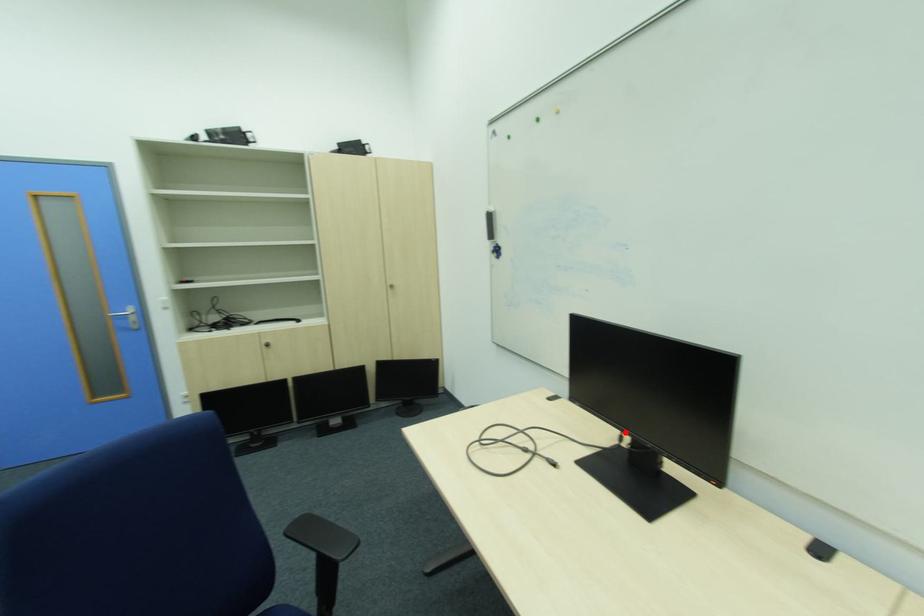
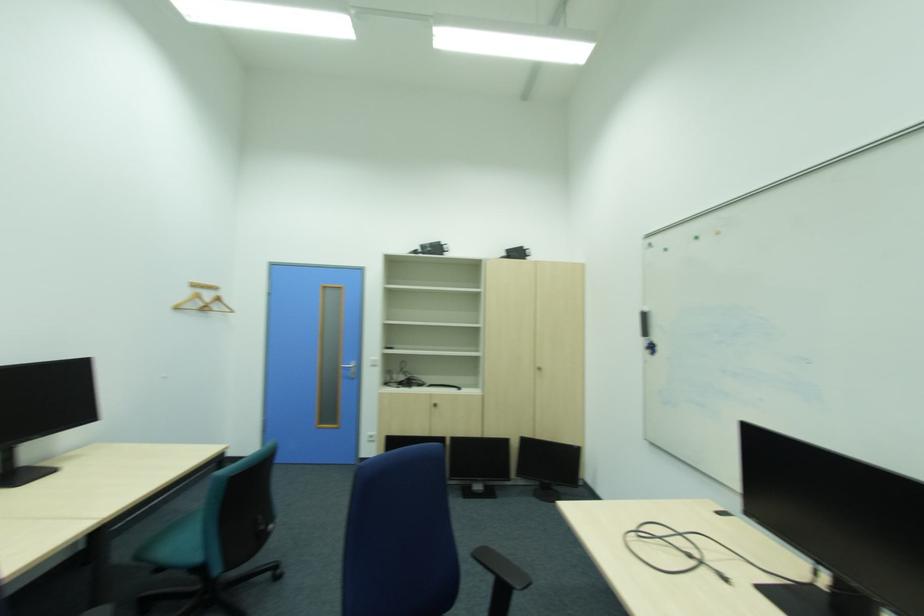
Locate, in the second image, the point that corresponds to the highlighted location in the first image.

(815, 561)